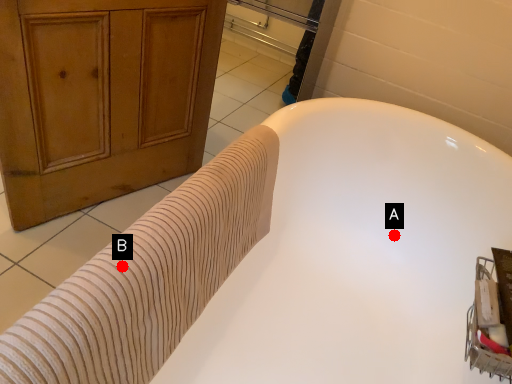
Question: Two points are circled on the image, labeled by A and B beside each circle. Among these points, which one is farthest from the camera?

Choices:
 (A) A is further
 (B) B is further

Answer: (A)